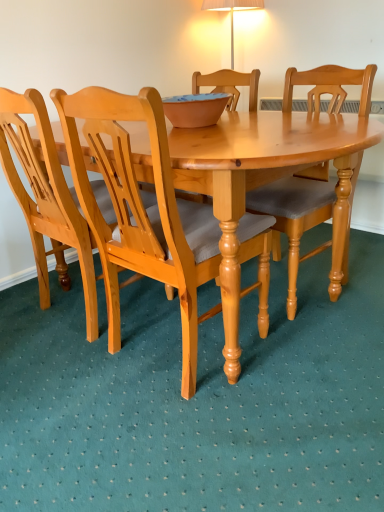
Question: Considering the positions of light brown wood chair at center, which is counted as the first chair, starting from the right, and light brown wood chair at center, the second chair in the left-to-right sequence, in the image, is light brown wood chair at center, which is counted as the first chair, starting from the right, wider or thinner than light brown wood chair at center, the second chair in the left-to-right sequence,?

Choices:
 (A) thin
 (B) wide

Answer: (B)

Question: Considering the positions of light brown wood chair at center, which is counted as the first chair, starting from the right, and light brown wood chair at center, which is the 2th chair from right to left, in the image, is light brown wood chair at center, which is counted as the first chair, starting from the right, taller or shorter than light brown wood chair at center, which is the 2th chair from right to left,?

Choices:
 (A) short
 (B) tall

Answer: (A)

Question: Estimate the real-world distances between objects in this image. Which object is closer to the light brown wood chair at center, the second chair in the left-to-right sequence?

Choices:
 (A) light brown wood chair at center, marked as the third chair in a left-to-right arrangement
 (B) light brown wood chair at left, the first chair in the left-to-right sequence
 (C) matte clay bowl at center

Answer: (B)

Question: Which of these objects is positioned closest to the matte clay bowl at center?

Choices:
 (A) light brown wood chair at center, which is counted as the first chair, starting from the right
 (B) light brown wood chair at left, placed as the 3th chair when sorted from right to left
 (C) light brown wood chair at center, the second chair in the left-to-right sequence

Answer: (C)